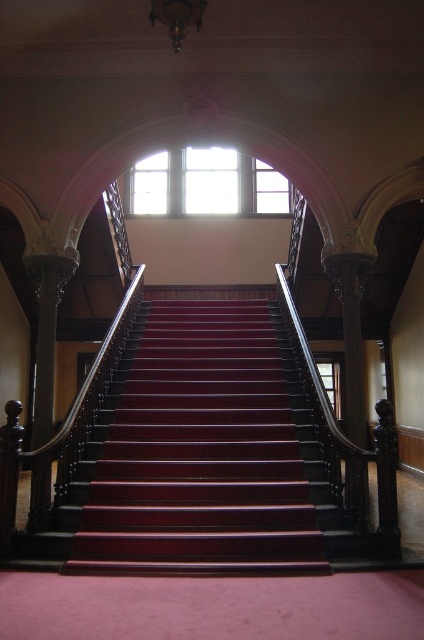
You are an interior designer assessing the staircase area. You need to place a decorative plant pot between the mahogany stairs at center and the clear glass window at upper center. Based on their positions, which object should the plant pot be closer to?

The mahogany stairs at center is to the left of clear glass window at upper center, so the plant pot should be placed closer to the clear glass window at upper center since it is positioned to the right of the stairs.

You are a painter standing at the bottom of the mahogany stairs at center. You want to paint the clear glass window at upper center. Can you reach it from where you are standing?

The mahogany stairs at center is located below the clear glass window at upper center, so you can reach it by climbing the stairs.